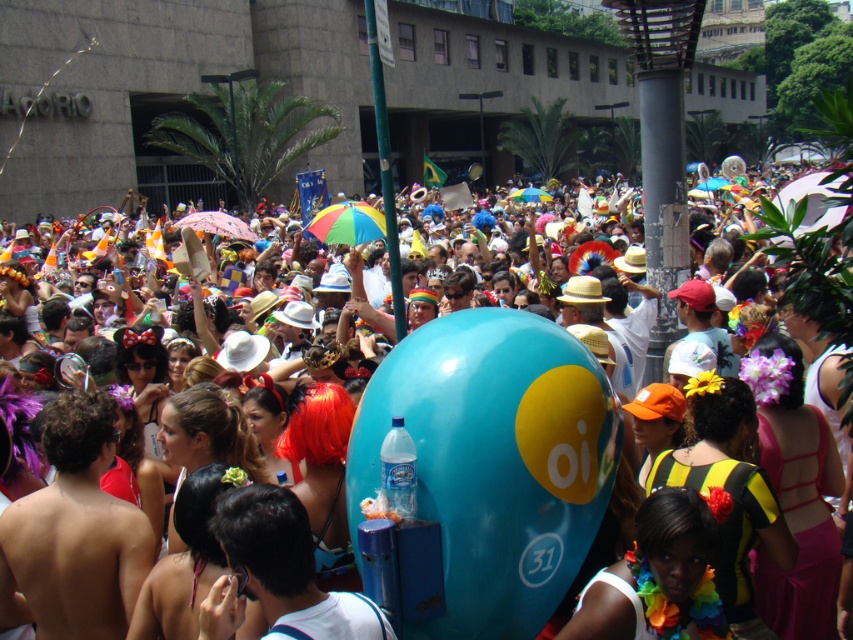
Does point (474, 545) come in front of point (608, 572)?

That is False.

Does blue glossy balloon at center appear on the right side of multicolored fabric lei at center?

No, blue glossy balloon at center is not to the right of multicolored fabric lei at center.

Who is more forward, (x=590, y=403) or (x=662, y=504)?

Point (x=662, y=504)

Locate an element on the screen. blue glossy balloon at center is located at coordinates (494, 461).